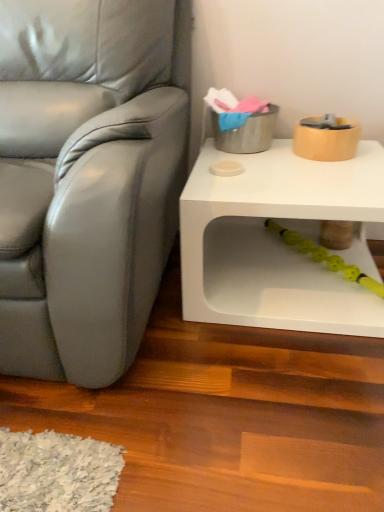
What are the coordinates of `free space to the left of yellow rubber toy at lower center` in the screenshot? It's located at (260, 287).